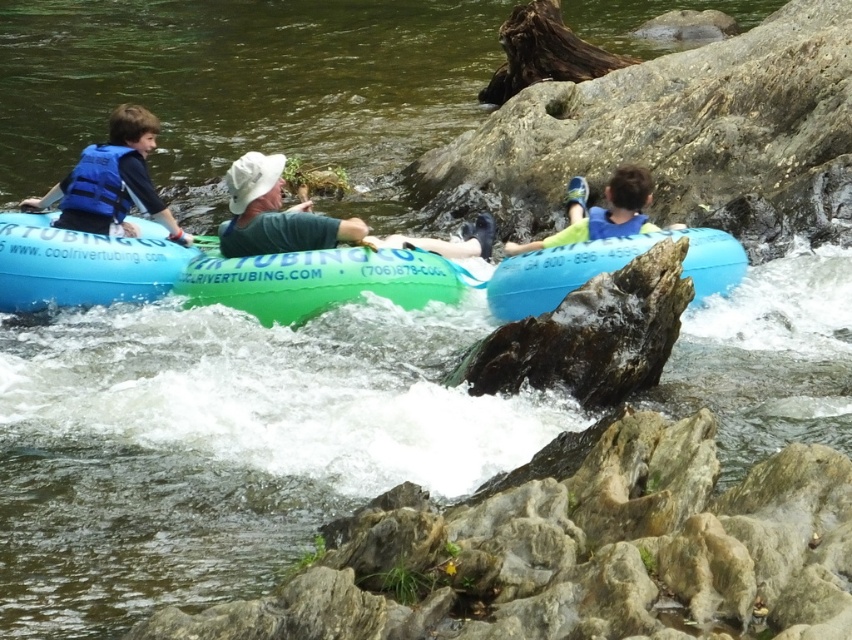
You are a river safety inspector checking equipment dimensions. According to the regulations, the tube must be wider than the life vest to ensure stability. Are the blue rubber tube at center and blue life vest at left compliant with this requirement?

The blue rubber tube at center is narrower than the blue life vest at left, so they are not compliant with the requirement since the tube must be wider than the life vest for stability.

You are navigating a river tube and need to reach the exit point marked by point (128,232). There is an obstacle at point (695,262). Will you pass the obstacle before or after reaching the exit?

The obstacle at point (695,262) is in front of the exit point (128,232). Therefore, you will pass the obstacle before reaching the exit.